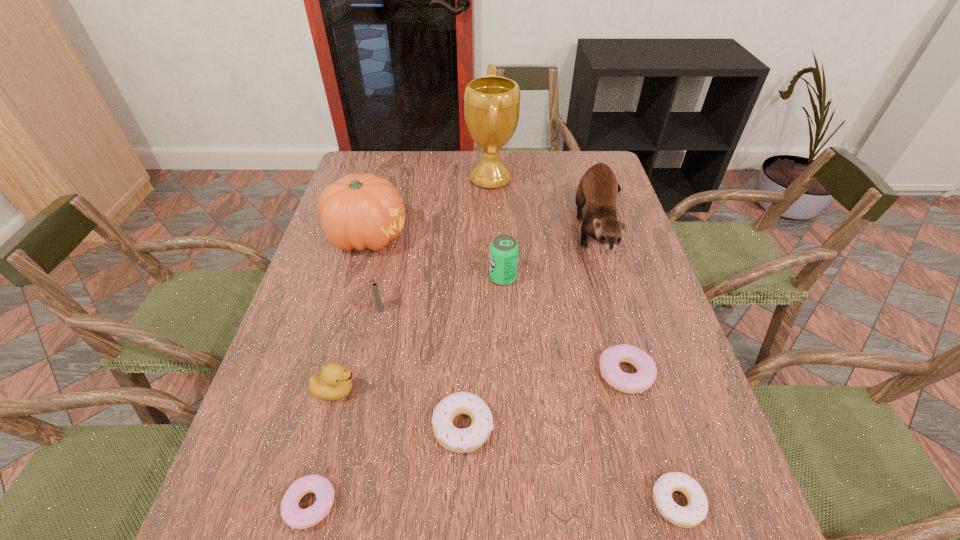
I want to click on pumpkin located in the left edge section of the desktop, so click(x=357, y=211).

Find the location of a particular element. This screenshot has height=540, width=960. duckling located at the left edge is located at coordinates (334, 382).

Where is `doughnut present at the left edge`? This screenshot has width=960, height=540. doughnut present at the left edge is located at coordinates (297, 518).

Find the location of a particular element. ferret that is at the right edge is located at coordinates (597, 190).

Where is `object present at the near left corner`? Image resolution: width=960 pixels, height=540 pixels. object present at the near left corner is located at coordinates (297, 518).

Find the location of a particular element. This screenshot has width=960, height=540. object that is positioned at the far right corner is located at coordinates (597, 190).

At what (x,y) coordinates should I click in order to perform the action: click on object that is at the near right corner. Please return your answer as a coordinate pair (x, y). This screenshot has width=960, height=540. Looking at the image, I should click on (694, 513).

Identify the location of free space at the far edge. point(540,173).

Identify the location of free spot at the left edge of the desktop. Image resolution: width=960 pixels, height=540 pixels. (305, 430).

In order to click on vacant space at the right edge of the desktop in this screenshot , I will do tap(661, 344).